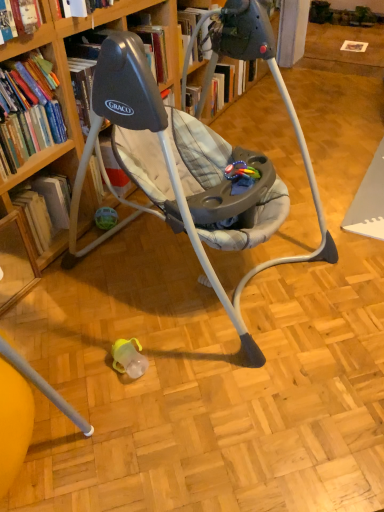
Describe the element at coordinates (196, 152) in the screenshot. I see `wooden bookcase at upper left` at that location.

Where is `hardcover book at left, which is the first book in bottom-to-top order`? The height and width of the screenshot is (512, 384). hardcover book at left, which is the first book in bottom-to-top order is located at coordinates point(45,208).

Where is `wooden bookcase at upper left`? The width and height of the screenshot is (384, 512). wooden bookcase at upper left is located at coordinates (196, 152).

Identify the location of book that is the 1st one when counting leftward from the wooden bookcase at upper left. (45, 208).

Considering the positions of point (44, 241) and point (125, 110), is point (44, 241) closer or farther from the camera than point (125, 110)?

Point (44, 241) is farther from the camera than point (125, 110).

Which object is more forward, hardcover book at left, which is the first book in bottom-to-top order, or wooden bookcase at upper left?

wooden bookcase at upper left is closer to the camera.

From a real-world perspective, which object rests below the other?

From a 3D spatial view, hardcover book at left, positioned as the 2th book in top-to-bottom order, is below.

Based on the photo, which object is wider, wooden bookcase at upper left or hardcover book at left, positioned as the 2th book in top-to-bottom order?

With larger width is wooden bookcase at upper left.

You are a GUI agent. You are given a task and a screenshot of the screen. Output one action in this format:
    pyautogui.click(x=<x>, y=<y>)
    Task: Click on the book beneath the wooden bookcase at upper left (from a real-world perspective)
    
    Given the screenshot: What is the action you would take?
    pyautogui.click(x=45, y=208)

Is wooden bookcase at upper left not near hardcover book at left, which is the first book in bottom-to-top order?

No, wooden bookcase at upper left is not far from hardcover book at left, which is the first book in bottom-to-top order.

Looking at this image, from a real-world perspective, is wooden bookcase at upper left positioned under hardcover book at left, positioned as the 2th book in top-to-bottom order, based on gravity?

No.

The height and width of the screenshot is (512, 384). In order to click on bookcase located below the hardcover book at left, placed as the first book when sorted from top to bottom (from the image's perspective) in this screenshot , I will do `click(196, 152)`.

Considering the relative sizes of wooden bookcase at upper left and hardcover book at left, which is counted as the 2th book, starting from the bottom, in the image provided, is wooden bookcase at upper left bigger than hardcover book at left, which is counted as the 2th book, starting from the bottom,?

Result: Correct, wooden bookcase at upper left is larger in size than hardcover book at left, which is counted as the 2th book, starting from the bottom.

Can you confirm if wooden bookcase at upper left is taller than hardcover book at left, which is counted as the 2th book, starting from the bottom?

Yes.

Considering the points (195, 179) and (0, 170), which point is in front, point (195, 179) or point (0, 170)?

Positioned in front is point (0, 170).

In terms of height, does hardcover book at left, which is counted as the 2th book, starting from the bottom, look taller or shorter compared to hardcover book at left, which is the first book in bottom-to-top order?

Considering their sizes, hardcover book at left, which is counted as the 2th book, starting from the bottom, has more height than hardcover book at left, which is the first book in bottom-to-top order.

In the scene shown: Would you consider hardcover book at left, placed as the first book when sorted from top to bottom, to be distant from hardcover book at left, positioned as the 2th book in top-to-bottom order?

Actually, hardcover book at left, placed as the first book when sorted from top to bottom, and hardcover book at left, positioned as the 2th book in top-to-bottom order, are a little close together.

From a real-world perspective, is hardcover book at left, which is counted as the 2th book, starting from the bottom, positioned over hardcover book at left, positioned as the 2th book in top-to-bottom order, based on gravity?

Yes.

From a real-world perspective, who is located lower, hardcover book at left, positioned as the 2th book in top-to-bottom order, or hardcover book at left, which is counted as the 2th book, starting from the bottom?

hardcover book at left, positioned as the 2th book in top-to-bottom order.

Are hardcover book at left, which is the first book in bottom-to-top order, and hardcover book at left, placed as the first book when sorted from top to bottom, far apart?

No, there isn't a large distance between hardcover book at left, which is the first book in bottom-to-top order, and hardcover book at left, placed as the first book when sorted from top to bottom.

Does hardcover book at left, which is the first book in bottom-to-top order, have a lesser width compared to hardcover book at left, which is counted as the 2th book, starting from the bottom?

Incorrect, the width of hardcover book at left, which is the first book in bottom-to-top order, is not less than that of hardcover book at left, which is counted as the 2th book, starting from the bottom.

From the image's perspective, who appears lower, hardcover book at left, positioned as the 2th book in top-to-bottom order, or hardcover book at left, placed as the first book when sorted from top to bottom?

hardcover book at left, positioned as the 2th book in top-to-bottom order, appears lower in the image.

Which is behind, point (43, 130) or point (176, 135)?

The point (176, 135) is farther.

From the image's perspective, is hardcover book at left, which is counted as the 2th book, starting from the bottom, on top of wooden bookcase at upper left?

Indeed, from the image's perspective, hardcover book at left, which is counted as the 2th book, starting from the bottom, is shown above wooden bookcase at upper left.

Is hardcover book at left, placed as the first book when sorted from top to bottom, oriented away from wooden bookcase at upper left?

No, hardcover book at left, placed as the first book when sorted from top to bottom,'s orientation is not away from wooden bookcase at upper left.

From a real-world perspective, which is physically below, hardcover book at left, placed as the first book when sorted from top to bottom, or wooden bookcase at upper left?

From a 3D spatial view, wooden bookcase at upper left is below.

From the wooden bookcase at upper left, count the 1st book to the left and point to it. Please provide its 2D coordinates.

[(45, 208)]

I want to click on bookcase that appears on the right of hardcover book at left, positioned as the 2th book in top-to-bottom order, so click(196, 152).

When comparing their distances from hardcover book at left, positioned as the 2th book in top-to-bottom order, does wooden bookcase at upper left or hardcover book at left, placed as the first book when sorted from top to bottom, seem closer?

The object closer to hardcover book at left, positioned as the 2th book in top-to-bottom order, is hardcover book at left, placed as the first book when sorted from top to bottom.

Considering their positions, is hardcover book at left, which is the first book in bottom-to-top order, positioned closer to wooden bookcase at upper left than hardcover book at left, placed as the first book when sorted from top to bottom?

Based on the image, hardcover book at left, which is the first book in bottom-to-top order, appears to be nearer to wooden bookcase at upper left.

When comparing their distances from wooden bookcase at upper left, does hardcover book at left, which is counted as the 2th book, starting from the bottom, or hardcover book at left, which is the first book in bottom-to-top order, seem further?

The object further to wooden bookcase at upper left is hardcover book at left, which is counted as the 2th book, starting from the bottom.

From the picture: Looking at the image, which one is located closer to hardcover book at left, which is counted as the 2th book, starting from the bottom, wooden bookcase at upper left or hardcover book at left, positioned as the 2th book in top-to-bottom order?

hardcover book at left, positioned as the 2th book in top-to-bottom order, is closer to hardcover book at left, which is counted as the 2th book, starting from the bottom.

Based on their spatial positions, is hardcover book at left, which is the first book in bottom-to-top order, or wooden bookcase at upper left closer to hardcover book at left, which is counted as the 2th book, starting from the bottom?

hardcover book at left, which is the first book in bottom-to-top order, is positioned closer to the anchor hardcover book at left, which is counted as the 2th book, starting from the bottom.

Based on their spatial positions, is hardcover book at left, placed as the first book when sorted from top to bottom, or wooden bookcase at upper left further from hardcover book at left, positioned as the 2th book in top-to-bottom order?

wooden bookcase at upper left is further to hardcover book at left, positioned as the 2th book in top-to-bottom order.

Find the location of a particular element. book between wooden bookcase at upper left and hardcover book at left, positioned as the 2th book in top-to-bottom order, along the z-axis is located at coordinates (28, 111).